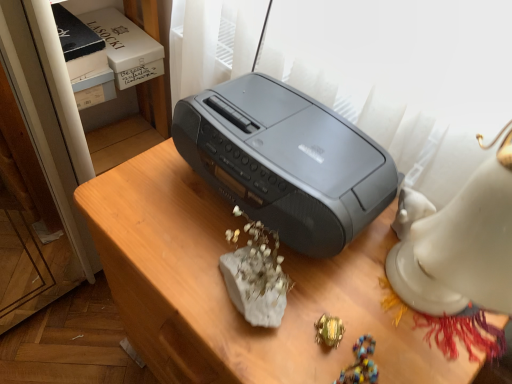
Identify the location of satin gray radio at center. (226, 291).

Locate an element on the screen. The image size is (512, 384). slate gray plastic printer at center is located at coordinates (286, 161).

The width and height of the screenshot is (512, 384). I want to click on green metallic ring at lower center, so click(329, 330).

Can you confirm if green metallic ring at lower center is shorter than slate gray plastic printer at center?

Indeed, green metallic ring at lower center has a lesser height compared to slate gray plastic printer at center.

Is green metallic ring at lower center positioned beyond the bounds of slate gray plastic printer at center?

Yes, green metallic ring at lower center is outside of slate gray plastic printer at center.

Looking at their sizes, would you say green metallic ring at lower center is wider or thinner than slate gray plastic printer at center?

In the image, green metallic ring at lower center appears to be more narrow than slate gray plastic printer at center.

Based on their positions, is green metallic ring at lower center located to the left or right of slate gray plastic printer at center?

In the image, green metallic ring at lower center appears on the right side of slate gray plastic printer at center.

Considering the sizes of objects satin gray radio at center and slate gray plastic printer at center in the image provided, who is wider, satin gray radio at center or slate gray plastic printer at center?

satin gray radio at center.

Who is shorter, satin gray radio at center or slate gray plastic printer at center?

slate gray plastic printer at center is shorter.

Is point (162, 181) more distant than point (185, 101)?

Yes.

Is satin gray radio at center aimed at slate gray plastic printer at center?

No, satin gray radio at center does not turn towards slate gray plastic printer at center.

From a real-world perspective, which is physically above, satin gray radio at center or green metallic ring at lower center?

green metallic ring at lower center, from a real-world perspective.

Between point (137, 178) and point (337, 337), which one is positioned behind?

Positioned behind is point (137, 178).

What's the angular difference between satin gray radio at center and green metallic ring at lower center's facing directions?

The facing directions of satin gray radio at center and green metallic ring at lower center are 42.5 degrees apart.

Is satin gray radio at center inside or outside of green metallic ring at lower center?

satin gray radio at center is not inside green metallic ring at lower center, it's outside.

Looking at this image, does slate gray plastic printer at center have a lesser height compared to green metallic ring at lower center?

In fact, slate gray plastic printer at center may be taller than green metallic ring at lower center.

Is slate gray plastic printer at center in contact with green metallic ring at lower center?

No, slate gray plastic printer at center is not touching green metallic ring at lower center.

Is slate gray plastic printer at center turned away from green metallic ring at lower center?

No.

Does green metallic ring at lower center have a smaller size compared to satin gray radio at center?

Correct, green metallic ring at lower center occupies less space than satin gray radio at center.

Can you confirm if green metallic ring at lower center is positioned to the right of satin gray radio at center?

Indeed, green metallic ring at lower center is positioned on the right side of satin gray radio at center.

Identify the location of jewellery above the satin gray radio at center (from a real-world perspective). This screenshot has width=512, height=384. (329, 330).

Considering the relative positions of slate gray plastic printer at center and satin gray radio at center in the image provided, is slate gray plastic printer at center behind satin gray radio at center?

Yes, slate gray plastic printer at center is further from the viewer.

From a real-world perspective, which object stands above the other?

slate gray plastic printer at center.

Does slate gray plastic printer at center turn towards satin gray radio at center?

No, slate gray plastic printer at center does not turn towards satin gray radio at center.

From the picture: Is slate gray plastic printer at center positioned far away from satin gray radio at center?

That's not correct — slate gray plastic printer at center is a little close to satin gray radio at center.

Where is `printer above the green metallic ring at lower center (from the image's perspective)`? Image resolution: width=512 pixels, height=384 pixels. printer above the green metallic ring at lower center (from the image's perspective) is located at coordinates tap(286, 161).

This screenshot has height=384, width=512. In order to click on furniture below the slate gray plastic printer at center (from a real-world perspective) in this screenshot , I will do `click(226, 291)`.

Which object lies further to the anchor point green metallic ring at lower center, slate gray plastic printer at center or satin gray radio at center?

slate gray plastic printer at center.

In the scene shown: From the image, which object appears to be farther from satin gray radio at center, slate gray plastic printer at center or green metallic ring at lower center?

Among the two, green metallic ring at lower center is located further to satin gray radio at center.

From the image, which object appears to be farther from green metallic ring at lower center, satin gray radio at center or slate gray plastic printer at center?

slate gray plastic printer at center lies further to green metallic ring at lower center than the other object.

When comparing their distances from slate gray plastic printer at center, does green metallic ring at lower center or satin gray radio at center seem further?

The object further to slate gray plastic printer at center is green metallic ring at lower center.

Estimate the real-world distances between objects in this image. Which object is closer to slate gray plastic printer at center, satin gray radio at center or green metallic ring at lower center?

satin gray radio at center.

Estimate the real-world distances between objects in this image. Which object is closer to satin gray radio at center, green metallic ring at lower center or slate gray plastic printer at center?

slate gray plastic printer at center.

Locate an element on the screen. The height and width of the screenshot is (384, 512). jewellery between slate gray plastic printer at center and satin gray radio at center vertically is located at coordinates coord(329,330).